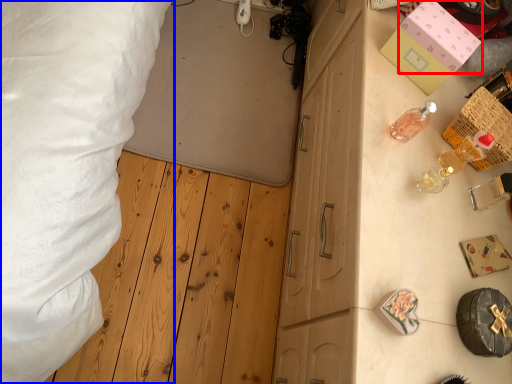
Question: Which point is closer to the camera, box (highlighted by a red box) or bed (highlighted by a blue box)?

Choices:
 (A) box
 (B) bed

Answer: (A)